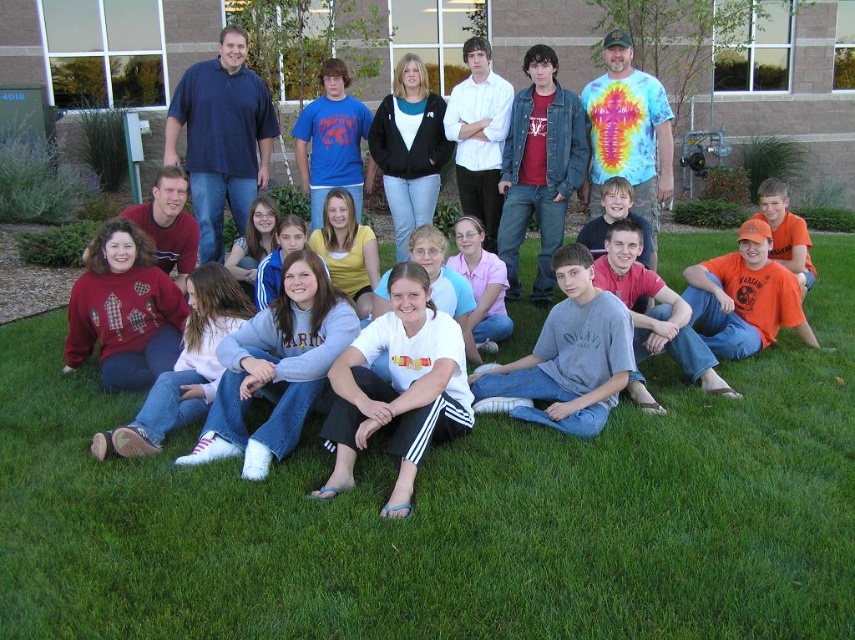
Between point (416, 339) and point (519, 419), which one is positioned in front?

Point (416, 339) is more forward.

Which is in front, point (439, 314) or point (563, 273)?

Point (439, 314)

Where is `white cotton shirt at center`? The height and width of the screenshot is (640, 855). white cotton shirt at center is located at coordinates (398, 388).

Can you confirm if green grass at lower center is shorter than white cotton shirt at center?

Indeed, green grass at lower center has a lesser height compared to white cotton shirt at center.

Which is more to the right, green grass at lower center or white cotton shirt at center?

green grass at lower center

Which is behind, point (740, 554) or point (398, 436)?

The point (398, 436) is more distant.

I want to click on green grass at lower center, so click(x=450, y=515).

Which is in front, point (664, 628) or point (545, 349)?

Point (664, 628) is more forward.

Can you confirm if green grass at lower center is positioned below gray cotton shirt at center?

Yes.

Is point (4, 428) behind point (557, 262)?

No, (4, 428) is in front of (557, 262).

This screenshot has width=855, height=640. Find the location of `green grass at lower center`. green grass at lower center is located at coordinates (450, 515).